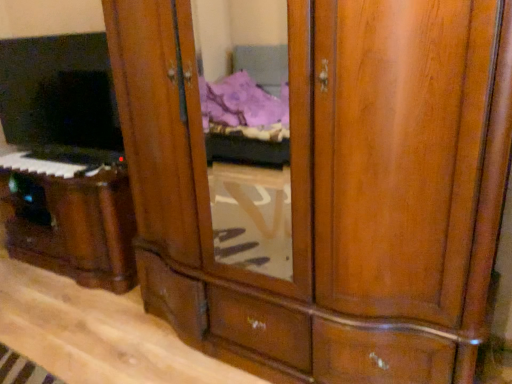
The width and height of the screenshot is (512, 384). I want to click on free space below matte black tv at left (from a real-world perspective), so point(59,157).